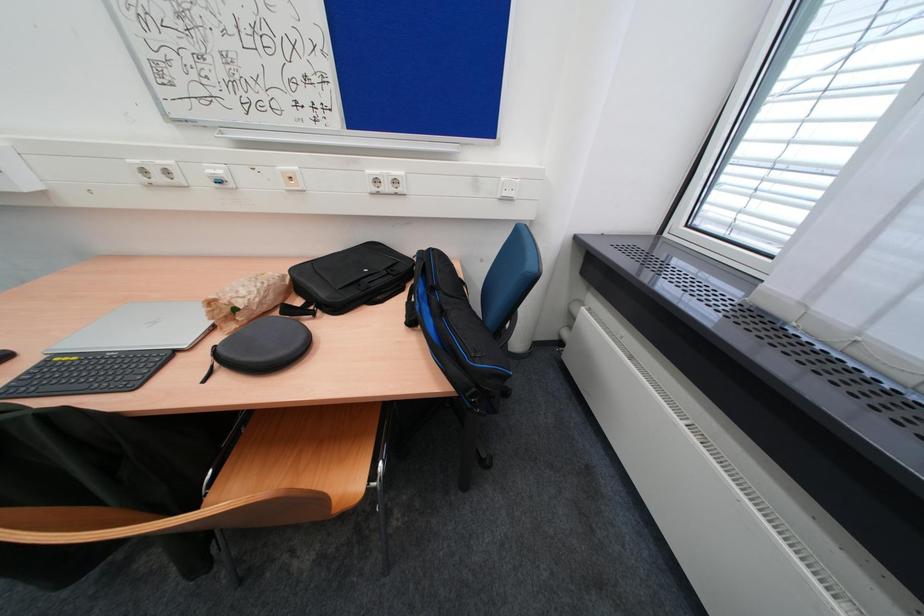
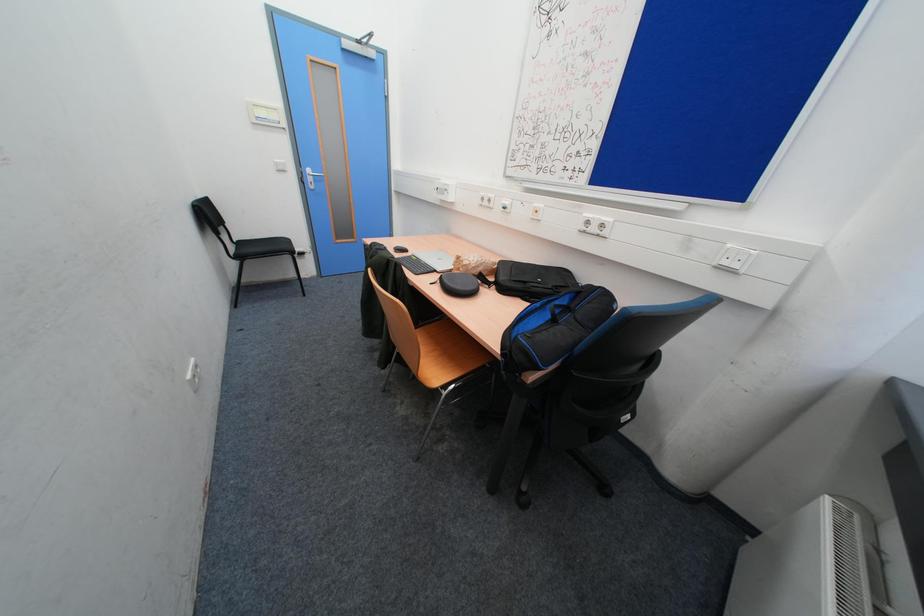
Question: Based on the continuous images, in which direction is the camera rotating? Reply with the corresponding letter.

Choices:
 (A) Left
 (B) Right
 (C) Up
 (D) Down

Answer: (A)